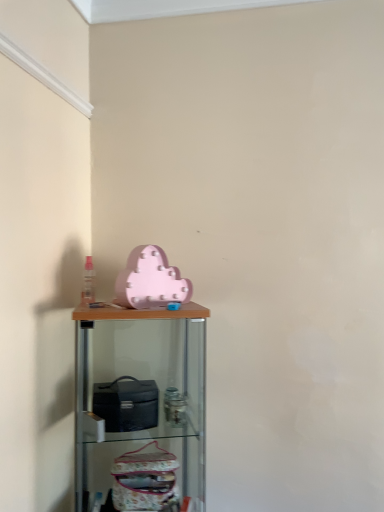
The height and width of the screenshot is (512, 384). What do you see at coordinates (140, 408) in the screenshot?
I see `pink matte cloud at upper center` at bounding box center [140, 408].

You are a GUI agent. You are given a task and a screenshot of the screen. Output one action in this format:
    pyautogui.click(x=<x>, y=<y>)
    Task: Click on the pink matte cloud at upper center
    
    Given the screenshot: What is the action you would take?
    pyautogui.click(x=140, y=408)

What is the approximate width of pink matte cloud at upper center?

pink matte cloud at upper center is 20.86 inches wide.

Identify the location of matte pink cloud at upper center. (151, 281).

Describe the element at coordinates (151, 281) in the screenshot. I see `matte pink cloud at upper center` at that location.

The height and width of the screenshot is (512, 384). In order to click on pink matte cloud at upper center in this screenshot , I will do `click(140, 408)`.

Which object is positioned more to the right, matte pink cloud at upper center or pink matte cloud at upper center?

matte pink cloud at upper center.

Which object is further away from the camera taking this photo, matte pink cloud at upper center or pink matte cloud at upper center?

Positioned behind is matte pink cloud at upper center.

Does point (155, 264) appear closer or farther from the camera than point (101, 345)?

Point (155, 264).

From the image's perspective, who appears lower, matte pink cloud at upper center or pink matte cloud at upper center?

pink matte cloud at upper center is shown below in the image.

Based on the photo, from a real-world perspective, which is physically below, matte pink cloud at upper center or pink matte cloud at upper center?

pink matte cloud at upper center is physically lower.

Which of these two, matte pink cloud at upper center or pink matte cloud at upper center, is wider?

With larger width is pink matte cloud at upper center.

Considering the sizes of objects matte pink cloud at upper center and pink matte cloud at upper center in the image provided, who is taller, matte pink cloud at upper center or pink matte cloud at upper center?

pink matte cloud at upper center.

Does matte pink cloud at upper center have a larger size compared to pink matte cloud at upper center?

Actually, matte pink cloud at upper center might be smaller than pink matte cloud at upper center.

Which is correct: matte pink cloud at upper center is inside pink matte cloud at upper center, or outside of it?

matte pink cloud at upper center is located beyond the bounds of pink matte cloud at upper center.

Is matte pink cloud at upper center beside pink matte cloud at upper center?

There is a gap between matte pink cloud at upper center and pink matte cloud at upper center.

Is matte pink cloud at upper center positioned with its back to pink matte cloud at upper center?

No, pink matte cloud at upper center is not at the back of matte pink cloud at upper center.

Identify the location of shelf below the matte pink cloud at upper center (from a real-world perspective). 140,408.

Which is more to the left, pink matte cloud at upper center or matte pink cloud at upper center?

From the viewer's perspective, pink matte cloud at upper center appears more on the left side.

In the scene shown: Considering the positions of objects pink matte cloud at upper center and matte pink cloud at upper center in the image provided, who is behind, pink matte cloud at upper center or matte pink cloud at upper center?

matte pink cloud at upper center is further away from the camera.

Which point is more distant from viewer, (202, 485) or (140, 289)?

The point (140, 289) is farther from the camera.

From the image's perspective, between pink matte cloud at upper center and matte pink cloud at upper center, which one is located above?

matte pink cloud at upper center is shown above in the image.

From a real-world perspective, is pink matte cloud at upper center physically above matte pink cloud at upper center?

No.

Considering the relative sizes of pink matte cloud at upper center and matte pink cloud at upper center in the image provided, is pink matte cloud at upper center wider than matte pink cloud at upper center?

Yes, pink matte cloud at upper center is wider than matte pink cloud at upper center.

Between pink matte cloud at upper center and matte pink cloud at upper center, which one has more height?

With more height is pink matte cloud at upper center.

Which of these two, pink matte cloud at upper center or matte pink cloud at upper center, is bigger?

With larger size is pink matte cloud at upper center.

Can we say pink matte cloud at upper center lies outside matte pink cloud at upper center?

That's correct, pink matte cloud at upper center is outside of matte pink cloud at upper center.

Does pink matte cloud at upper center touch matte pink cloud at upper center?

No.

Is pink matte cloud at upper center aimed at matte pink cloud at upper center?

No, pink matte cloud at upper center does not turn towards matte pink cloud at upper center.

Can you tell me how much pink matte cloud at upper center and matte pink cloud at upper center differ in facing direction?

44.3 degrees.

Image resolution: width=384 pixels, height=512 pixels. Identify the location of toy that is on the right side of pink matte cloud at upper center. (151, 281).

You are a GUI agent. You are given a task and a screenshot of the screen. Output one action in this format:
    pyautogui.click(x=<x>, y=<y>)
    Task: Click on the shelf on the left side of matte pink cloud at upper center
    
    Given the screenshot: What is the action you would take?
    pyautogui.click(x=140, y=408)

The width and height of the screenshot is (384, 512). I want to click on shelf that appears in front of the matte pink cloud at upper center, so click(140, 408).